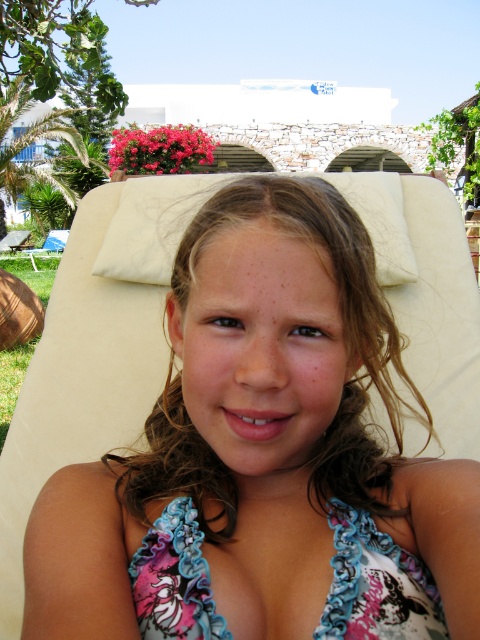
Question: Does pink floral swimsuit at center lie behind floral fabric bikini top at center?

Choices:
 (A) yes
 (B) no

Answer: (B)

Question: Which point is closer to the camera taking this photo?

Choices:
 (A) (376, 637)
 (B) (273, 332)

Answer: (A)

Question: Is pink floral swimsuit at center thinner than floral fabric bikini top at center?

Choices:
 (A) no
 (B) yes

Answer: (A)

Question: Does pink floral swimsuit at center appear on the left side of floral fabric bikini top at center?

Choices:
 (A) yes
 (B) no

Answer: (B)

Question: Among these objects, which one is nearest to the camera?

Choices:
 (A) pink floral swimsuit at center
 (B) floral fabric bikini top at center

Answer: (A)